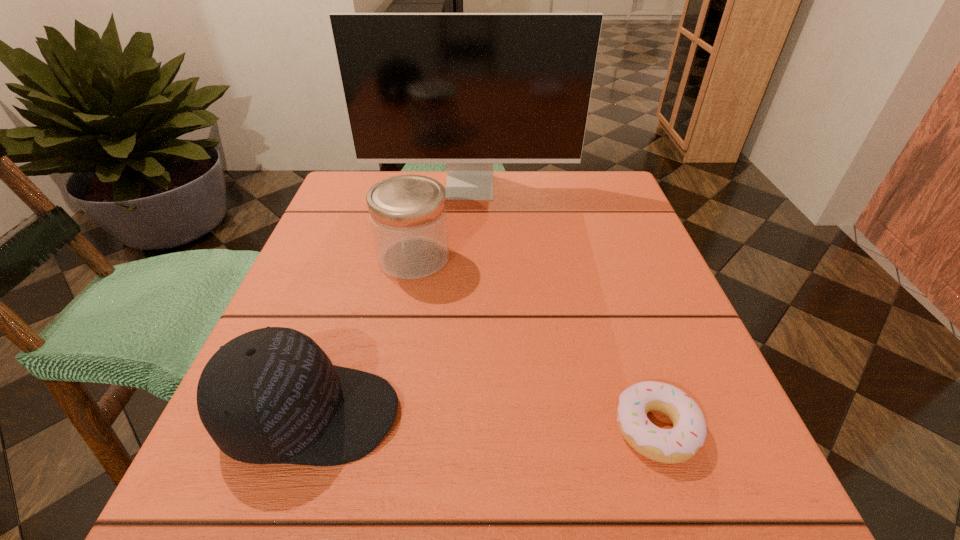
Locate an element on the screen. vacant point located between the monitor and the baseball cap is located at coordinates (391, 301).

Where is `empty location between the farthest object and the baseball cap`? Image resolution: width=960 pixels, height=540 pixels. empty location between the farthest object and the baseball cap is located at coordinates (391, 301).

Identify the location of free point between the baseball cap and the jar. (363, 336).

The image size is (960, 540). I want to click on unoccupied position between the second farthest object and the doughnut, so click(x=535, y=343).

Image resolution: width=960 pixels, height=540 pixels. Find the location of `empty location between the farthest object and the baseball cap`. empty location between the farthest object and the baseball cap is located at coordinates (391, 301).

This screenshot has width=960, height=540. I want to click on vacant area that lies between the jar and the shortest object, so click(535, 343).

The image size is (960, 540). Find the location of `vacant space that is in between the baseball cap and the tallest object`. vacant space that is in between the baseball cap and the tallest object is located at coordinates (391, 301).

Choose which object is the nearest neighbor to the farthest object. Please provide its 2D coordinates. Your answer should be formatted as a tuple, i.e. [(x, y)], where the tuple contains the x and y coordinates of a point satisfying the conditions above.

[(408, 216)]

At what (x,y) coordinates should I click in order to perform the action: click on object that ranks as the third closest to the second farthest object. Please return your answer as a coordinate pair (x, y). The width and height of the screenshot is (960, 540). Looking at the image, I should click on pyautogui.click(x=679, y=444).

Image resolution: width=960 pixels, height=540 pixels. I want to click on free point that satisfies the following two spatial constraints: 1. at the front of the baseball cap where the brim is located; 2. on the back side of the shortest object, so click(307, 428).